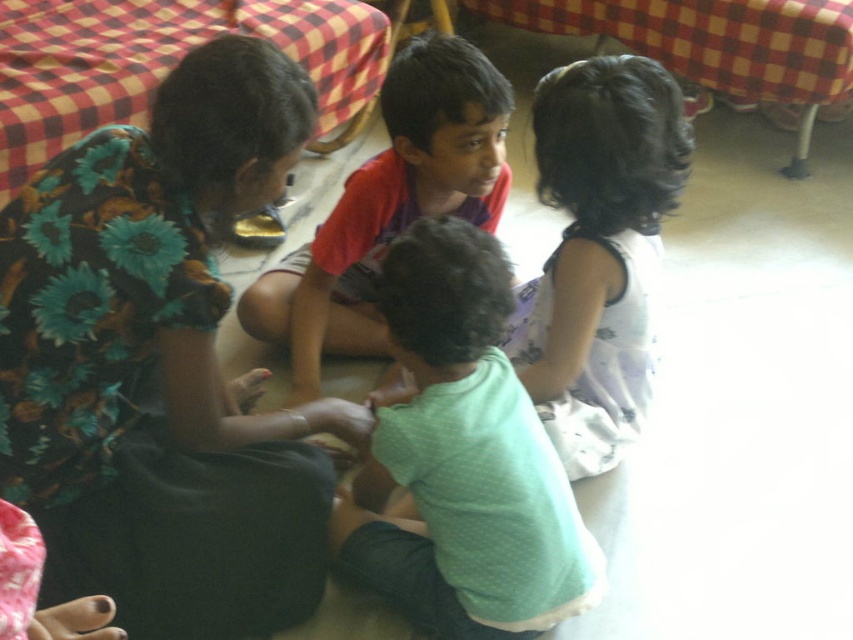
Question: Among these points, which one is nearest to the camera?

Choices:
 (A) (511, 378)
 (B) (457, 141)
 (C) (614, 196)

Answer: (A)

Question: Which point is closer to the camera taking this photo?

Choices:
 (A) (370, 259)
 (B) (447, 298)
 (C) (607, 96)
 (D) (276, 179)

Answer: (B)

Question: Among these objects, which one is nearest to the camera?

Choices:
 (A) floral fabric dress at upper left
 (B) white floral dress at upper right
 (C) green dotted shirt at center

Answer: (A)

Question: Is floral fabric dress at upper left positioned in front of green dotted shirt at center?

Choices:
 (A) yes
 (B) no

Answer: (A)

Question: Can you confirm if green dotted shirt at center is positioned above white floral dress at upper right?

Choices:
 (A) no
 (B) yes

Answer: (A)

Question: Is green dotted shirt at center above red shirt at center?

Choices:
 (A) no
 (B) yes

Answer: (A)